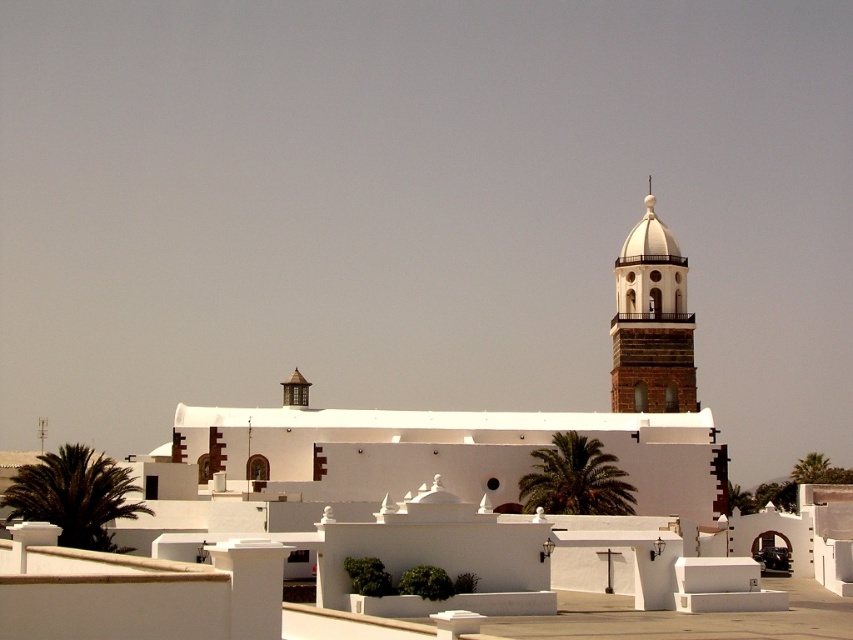
Question: Considering the relative positions of white stone bell tower at upper right and green leafy palm tree at center in the image provided, where is white stone bell tower at upper right located with respect to green leafy palm tree at center?

Choices:
 (A) below
 (B) above

Answer: (B)

Question: Which object appears farthest from the camera in this image?

Choices:
 (A) green leafy palm at lower left
 (B) green leafy palm tree at center

Answer: (B)

Question: Among these objects, which one is nearest to the camera?

Choices:
 (A) green leafy palm tree at center
 (B) white stone bell tower at upper right
 (C) green leafy palm at lower left

Answer: (C)

Question: Based on their relative distances, which object is farther from the white stone bell tower at upper right?

Choices:
 (A) green leafy palm at lower left
 (B) green leafy palm tree at center

Answer: (A)

Question: Does green leafy palm at lower left have a greater width compared to green leafy palm tree at center?

Choices:
 (A) no
 (B) yes

Answer: (B)

Question: Does white stone bell tower at upper right appear under green leafy palm at lower left?

Choices:
 (A) yes
 (B) no

Answer: (B)